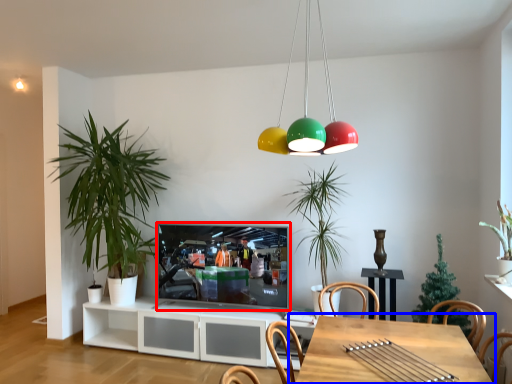
Question: Which object appears closest to the camera in this image, television (highlighted by a red box) or table (highlighted by a blue box)?

Choices:
 (A) television
 (B) table

Answer: (B)